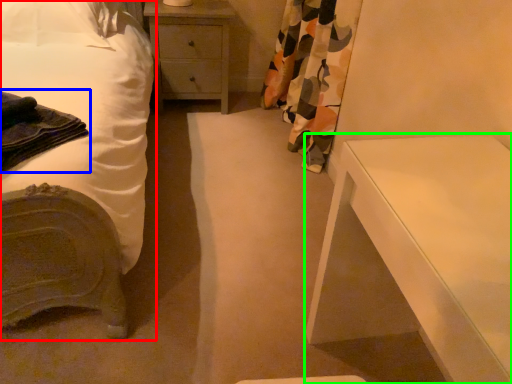
Question: Considering the real-world distances, which object is farthest from bed (highlighted by a red box)? material (highlighted by a blue box) or nightstand (highlighted by a green box)?

Choices:
 (A) material
 (B) nightstand

Answer: (B)